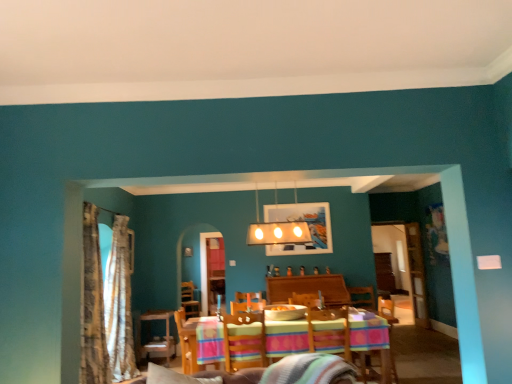
How much space does gold textured curtain at left, positioned as the second curtain in front-to-back order, occupy vertically?

The height of gold textured curtain at left, positioned as the second curtain in front-to-back order, is 7.18 feet.

Measure the distance between point [346,326] and camera.

The distance of point [346,326] from camera is 14.07 feet.

What do you see at coordinates (93, 305) in the screenshot? This screenshot has height=384, width=512. I see `textured beige curtain at left, the 1th curtain from the front` at bounding box center [93, 305].

The width and height of the screenshot is (512, 384). What do you see at coordinates (309, 370) in the screenshot? I see `striped woolen blanket at center` at bounding box center [309, 370].

The height and width of the screenshot is (384, 512). What do you see at coordinates (277, 231) in the screenshot? I see `white glossy light fixture at upper center` at bounding box center [277, 231].

In order to face white glossy light fixture at upper center, should I rotate leftwards or rightwards?

You should rotate right by 3.024 degrees.

The height and width of the screenshot is (384, 512). In order to click on transparent glass door at center in this screenshot , I will do `click(405, 262)`.

From a real-world perspective, is textured beige curtain at left, the 1th curtain from the front, physically below wooden swivel chair at center, which is the 2th swivel chair from right to left?

No, from a real-world perspective, textured beige curtain at left, the 1th curtain from the front, is not under wooden swivel chair at center, which is the 2th swivel chair from right to left.

Considering the relative positions of textured beige curtain at left, the 1th curtain from the front, and wooden swivel chair at center, which ranks as the 1th swivel chair in left-to-right order, in the image provided, is textured beige curtain at left, the 1th curtain from the front, in front of wooden swivel chair at center, which ranks as the 1th swivel chair in left-to-right order,?

No, textured beige curtain at left, the 1th curtain from the front, is behind wooden swivel chair at center, which ranks as the 1th swivel chair in left-to-right order.

Are textured beige curtain at left, the 2th curtain when ordered from back to front, and wooden swivel chair at center, which is the 2th swivel chair from right to left, located far from each other?

Yes, textured beige curtain at left, the 2th curtain when ordered from back to front, is far from wooden swivel chair at center, which is the 2th swivel chair from right to left.

Based on their sizes in the image, would you say textured beige curtain at left, the 2th curtain when ordered from back to front, is bigger or smaller than wooden swivel chair at center, which ranks as the 1th swivel chair in left-to-right order?

textured beige curtain at left, the 2th curtain when ordered from back to front, is bigger than wooden swivel chair at center, which ranks as the 1th swivel chair in left-to-right order.

Does wooden swivel chair at center, the 2th swivel chair positioned from the left, have a larger size compared to wooden table at center?

Incorrect, wooden swivel chair at center, the 2th swivel chair positioned from the left, is not larger than wooden table at center.

Is wooden swivel chair at center, the 2th swivel chair positioned from the left, beside wooden table at center?

No.

Considering the sizes of objects wooden swivel chair at center, the 2th swivel chair positioned from the left, and wooden table at center in the image provided, who is shorter, wooden swivel chair at center, the 2th swivel chair positioned from the left, or wooden table at center?

With less height is wooden swivel chair at center, the 2th swivel chair positioned from the left.

From the image's perspective, would you say metallic silver picture frame at center is shown under striped woolen blanket at center?

Actually, metallic silver picture frame at center appears above striped woolen blanket at center in the image.

From a real-world perspective, is metallic silver picture frame at center located higher than striped woolen blanket at center?

Result: Indeed, from a real-world perspective, metallic silver picture frame at center stands above striped woolen blanket at center.

How far apart are metallic silver picture frame at center and striped woolen blanket at center?

10.45 feet.

In order to click on blanket on the left side of metallic silver picture frame at center in this screenshot , I will do `click(309, 370)`.

Is striped woolen blanket at center facing towards multicolored fabric armchair at lower right, which is the 2th armchair in left-to-right order?

No.

Would you say striped woolen blanket at center is to the left or to the right of multicolored fabric armchair at lower right, which is the 2th armchair in left-to-right order, in the picture?

Based on their positions, striped woolen blanket at center is located to the left of multicolored fabric armchair at lower right, which is the 2th armchair in left-to-right order.

Between striped woolen blanket at center and multicolored fabric armchair at lower right, which is the 2th armchair in left-to-right order, which one has larger size?

With larger size is multicolored fabric armchair at lower right, which is the 2th armchair in left-to-right order.

From a real-world perspective, does striped woolen blanket at center stand above multicolored fabric armchair at lower right, which is counted as the 1th armchair, starting from the right?

Yes.

Can you confirm if gold textured curtain at left, acting as the 1th curtain starting from the back, is positioned to the left of wooden table with striped tablecloth at center?

Correct, you'll find gold textured curtain at left, acting as the 1th curtain starting from the back, to the left of wooden table with striped tablecloth at center.

Is gold textured curtain at left, positioned as the second curtain in front-to-back order, spatially inside wooden table with striped tablecloth at center, or outside of it?

gold textured curtain at left, positioned as the second curtain in front-to-back order, is outside wooden table with striped tablecloth at center.

Measure the distance between gold textured curtain at left, positioned as the second curtain in front-to-back order, and wooden table with striped tablecloth at center.

gold textured curtain at left, positioned as the second curtain in front-to-back order, and wooden table with striped tablecloth at center are 3.48 feet apart.

Considering the relative sizes of gold textured curtain at left, acting as the 1th curtain starting from the back, and wooden table with striped tablecloth at center in the image provided, is gold textured curtain at left, acting as the 1th curtain starting from the back, shorter than wooden table with striped tablecloth at center?

No, gold textured curtain at left, acting as the 1th curtain starting from the back, is not shorter than wooden table with striped tablecloth at center.

Which of these two, striped woolen blanket at center or wooden table with striped tablecloth at center, stands taller?

wooden table with striped tablecloth at center is taller.

From the image's perspective, does striped woolen blanket at center appear lower than wooden table with striped tablecloth at center?

Incorrect, from the image's perspective, striped woolen blanket at center is higher than wooden table with striped tablecloth at center.

In the image, is striped woolen blanket at center positioned in front of or behind wooden table with striped tablecloth at center?

In the image, striped woolen blanket at center appears in front of wooden table with striped tablecloth at center.

In the scene shown: Visually, is striped woolen blanket at center positioned to the left or to the right of wooden table with striped tablecloth at center?

Based on their positions, striped woolen blanket at center is located to the left of wooden table with striped tablecloth at center.

Considering the relative positions of wooden table with striped tablecloth at center and wooden swivel chair at center, marked as the first swivel chair in a right-to-left arrangement, in the image provided, is wooden table with striped tablecloth at center to the left or to the right of wooden swivel chair at center, marked as the first swivel chair in a right-to-left arrangement,?

wooden table with striped tablecloth at center is to the left of wooden swivel chair at center, marked as the first swivel chair in a right-to-left arrangement.

Can you tell me how much wooden table with striped tablecloth at center and wooden swivel chair at center, the 2th swivel chair positioned from the left, differ in facing direction?

wooden table with striped tablecloth at center and wooden swivel chair at center, the 2th swivel chair positioned from the left, are facing 179 degrees away from each other.

Is wooden table with striped tablecloth at center situated inside wooden swivel chair at center, the 2th swivel chair positioned from the left, or outside?

wooden table with striped tablecloth at center is spatially situated outside wooden swivel chair at center, the 2th swivel chair positioned from the left.

Is the surface of wooden table with striped tablecloth at center in direct contact with wooden swivel chair at center, the 2th swivel chair positioned from the left?

No, wooden table with striped tablecloth at center is not with wooden swivel chair at center, the 2th swivel chair positioned from the left.

Image resolution: width=512 pixels, height=384 pixels. I want to click on swivel chair that is the 2nd object located in front of the textured beige curtain at left, the 2th curtain when ordered from back to front, so click(x=244, y=342).

Locate an element on the screen. table located on the left of wooden swivel chair at center, marked as the first swivel chair in a right-to-left arrangement is located at coordinates (155, 336).

When comparing their distances from white glossy light fixture at upper center, does wooden table with striped tablecloth at center or gold textured curtain at left, acting as the 1th curtain starting from the back, seem closer?

wooden table with striped tablecloth at center lies closer to white glossy light fixture at upper center than the other object.

Considering their positions, is gold textured curtain at left, positioned as the second curtain in front-to-back order, positioned further to wooden swivel chair at center, the 2th swivel chair positioned from the left, than metallic silver picture frame at center?

The object further to wooden swivel chair at center, the 2th swivel chair positioned from the left, is gold textured curtain at left, positioned as the second curtain in front-to-back order.

When comparing their distances from metallic silver picture frame at center, does wooden table at center or gold textured curtain at left, positioned as the second curtain in front-to-back order, seem further?

Among the two, gold textured curtain at left, positioned as the second curtain in front-to-back order, is located further to metallic silver picture frame at center.

When comparing their distances from transparent glass door at center, does wooden swivel chair at center, which is the 2th swivel chair from right to left, or gold textured curtain at left, positioned as the second curtain in front-to-back order, seem closer?

Among the two, wooden swivel chair at center, which is the 2th swivel chair from right to left, is located nearer to transparent glass door at center.

When comparing their distances from gold textured curtain at left, acting as the 1th curtain starting from the back, does wooden swivel chair at center, marked as the first swivel chair in a right-to-left arrangement, or wooden table at center seem further?

wooden swivel chair at center, marked as the first swivel chair in a right-to-left arrangement, is positioned further to the anchor gold textured curtain at left, acting as the 1th curtain starting from the back.

From the image, which object appears to be farther from transparent glass door at center, wooden table at center or multicolored fabric armchair at lower right, which is counted as the 1th armchair, starting from the right?

Among the two, wooden table at center is located further to transparent glass door at center.

Which object lies nearer to the anchor point striped woolen blanket at center, wooden table at center or wooden table with striped tablecloth at center?

wooden table with striped tablecloth at center is closer to striped woolen blanket at center.

Considering their positions, is textured beige curtain at left, the 2th curtain when ordered from back to front, positioned further to wooden table with striped tablecloth at center than wooden swivel chair at center, marked as the first swivel chair in a right-to-left arrangement?

The object further to wooden table with striped tablecloth at center is textured beige curtain at left, the 2th curtain when ordered from back to front.

Identify the location of kitchen & dining room table between gold textured curtain at left, positioned as the second curtain in front-to-back order, and transparent glass door at center, in the horizontal direction. This screenshot has height=384, width=512. (372, 342).

Identify the location of lamp between multicolored fabric armchair at center, the first armchair positioned from the left, and multicolored fabric armchair at lower right, which is counted as the 1th armchair, starting from the right, from left to right. (277, 231).

Identify the location of swivel chair between gold textured curtain at left, positioned as the second curtain in front-to-back order, and wooden table with striped tablecloth at center, in the horizontal direction. This screenshot has width=512, height=384. (244, 342).

Image resolution: width=512 pixels, height=384 pixels. Identify the location of picture frame between textured beige curtain at left, the 2th curtain when ordered from back to front, and transparent glass door at center, in the horizontal direction. (307, 224).